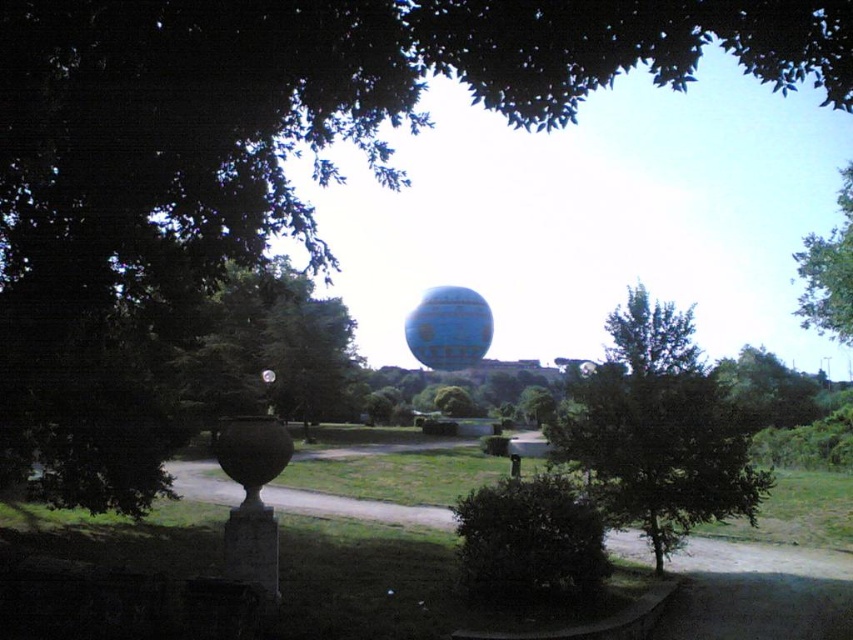
Can you confirm if green leafy tree at center is positioned above blue rubber balloon at center?

No, green leafy tree at center is not above blue rubber balloon at center.

Can you confirm if green leafy tree at center is taller than blue rubber balloon at center?

Yes, green leafy tree at center is taller than blue rubber balloon at center.

Between point (744, 440) and point (467, 301), which one is positioned behind?

Positioned behind is point (467, 301).

Image resolution: width=853 pixels, height=640 pixels. In order to click on green leafy tree at center in this screenshot , I will do `click(657, 429)`.

Is green leafy tree at center bigger than green leafy tree at left?

No.

Describe the element at coordinates (657, 429) in the screenshot. I see `green leafy tree at center` at that location.

Identify the location of green leafy tree at center. This screenshot has width=853, height=640. (657, 429).

You are a GUI agent. You are given a task and a screenshot of the screen. Output one action in this format:
    pyautogui.click(x=<x>, y=<y>)
    Task: Click on the green leafy tree at center
    Image resolution: width=853 pixels, height=640 pixels.
    Given the screenshot: What is the action you would take?
    pyautogui.click(x=657, y=429)

Which of these two, green leafy tree at center or green leafy tree at upper right, stands taller?

green leafy tree at upper right

Describe the element at coordinates (657, 429) in the screenshot. I see `green leafy tree at center` at that location.

Locate an element on the screen. green leafy tree at center is located at coordinates (657, 429).